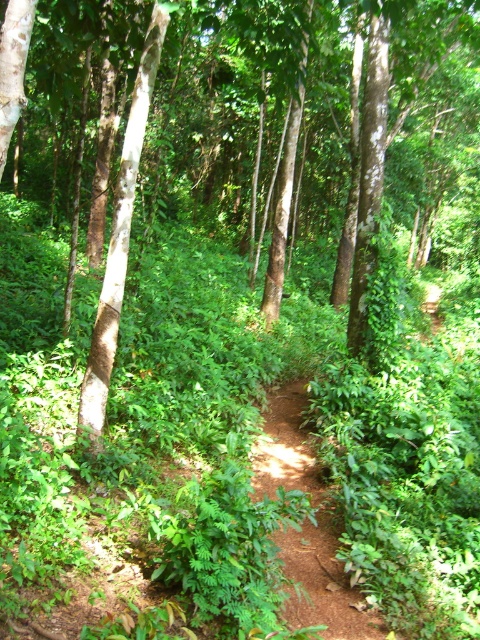
Question: Is brown smooth tree at center wider than brown dirt path at center?

Choices:
 (A) yes
 (B) no

Answer: (A)

Question: Is brown smooth tree at center positioned behind brown dirt path at center?

Choices:
 (A) no
 (B) yes

Answer: (A)

Question: Is brown smooth tree at center above brown dirt path at center?

Choices:
 (A) no
 (B) yes

Answer: (B)

Question: Which point is closer to the camera?

Choices:
 (A) (290, 3)
 (B) (308, 481)

Answer: (B)